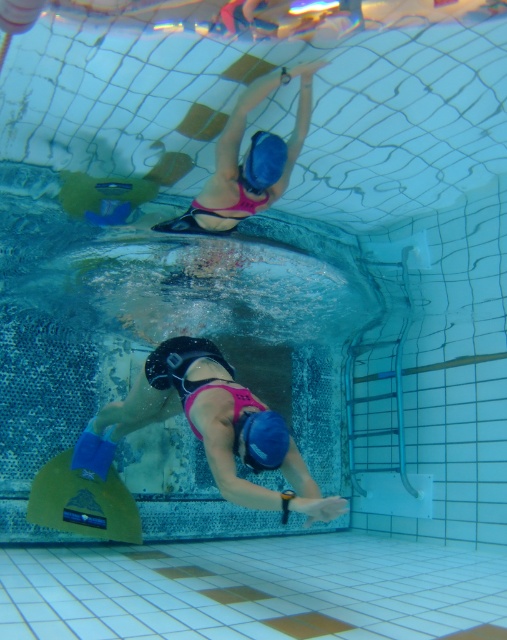
Who is positioned more to the right, pink matte swimsuit at center or matte blue snorkel at upper center?

From the viewer's perspective, matte blue snorkel at upper center appears more on the right side.

Is point (176, 342) in front of point (234, 145)?

No, (176, 342) is further to viewer.

I want to click on pink matte swimsuit at center, so click(209, 428).